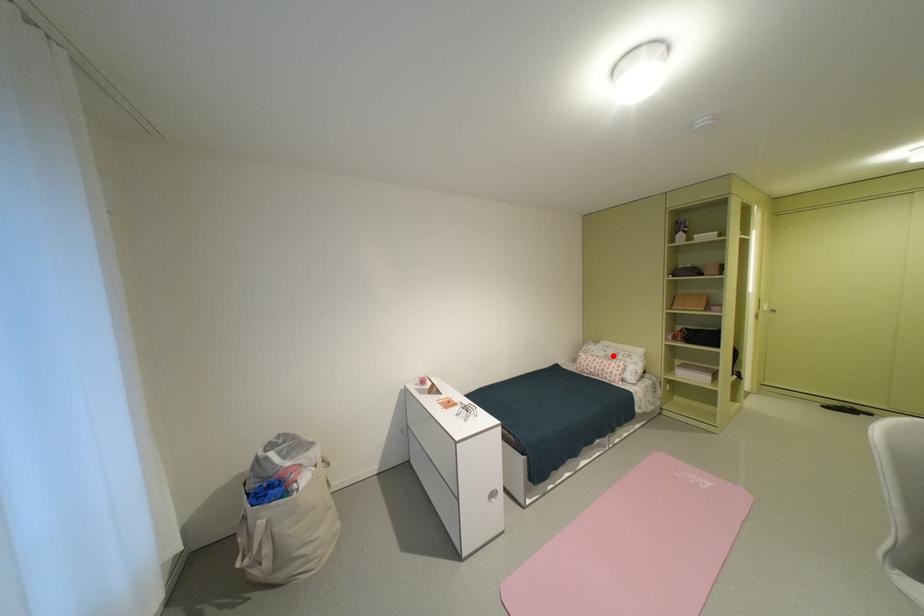
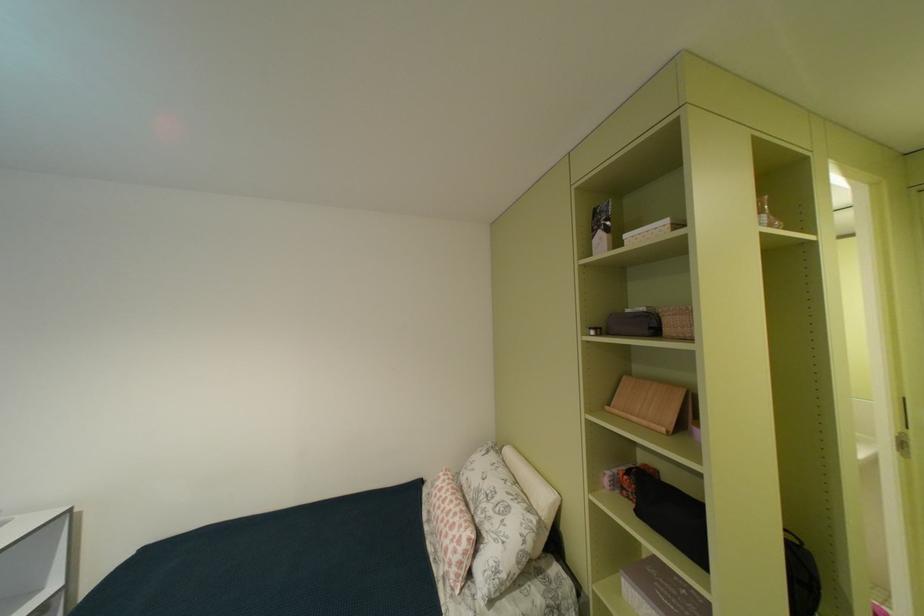
In the second image, find the point that corresponds to the highlighted location in the first image.

(487, 487)